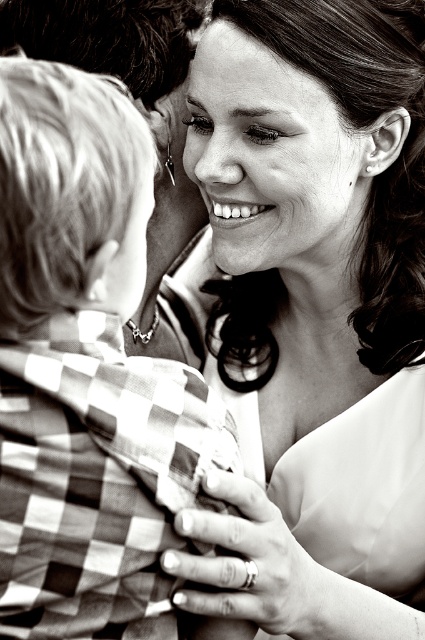
You are a photographer standing at the point marked by the coordinate point (342, 502). You want to take a photo of the two people in the scene. However, you need to ensure that you are at least 1.2 meters away from them to avoid disturbing their moment. Based on the given information, can you safely take the photo without getting too close?

The distance between the point marked by the coordinate point (342, 502) and the camera is 1.07 meters. Since this distance is less than the required 1.2 meters, you are too close to take the photo without disturbing them.

You are an observer standing in front of the photograph. You see the checkered fabric shirt at left and the smooth skin face at upper center. Which object is positioned higher in the image?

The smooth skin face at upper center is positioned higher than the checkered fabric shirt at left.